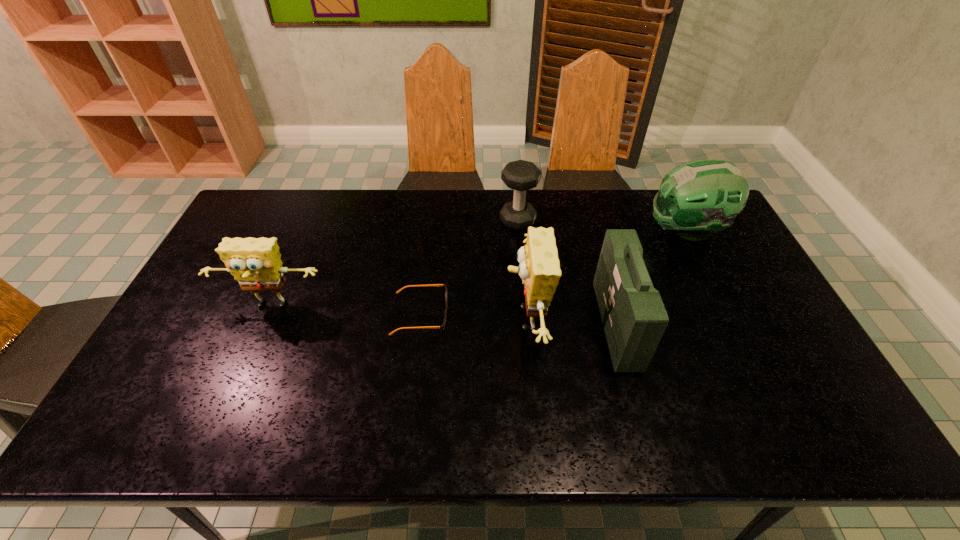
The image size is (960, 540). Find the location of `vacant space located 0.320m on the face of the taller sponge`. vacant space located 0.320m on the face of the taller sponge is located at coordinates (389, 320).

This screenshot has height=540, width=960. Find the location of `vacant space located on the face of the taller sponge`. vacant space located on the face of the taller sponge is located at coordinates (454, 320).

You are a GUI agent. You are given a task and a screenshot of the screen. Output one action in this format:
    pyautogui.click(x=<x>, y=<y>)
    Task: Click on the vacant point located on the right of the dumbbell
    
    Given the screenshot: What is the action you would take?
    pyautogui.click(x=554, y=221)

This screenshot has height=540, width=960. In order to click on free region located 0.310m on the visor of the rightmost object in this screenshot , I will do (555, 231).

Locate an element on the screen. The width and height of the screenshot is (960, 540). vacant area situated on the visor of the rightmost object is located at coordinates (552, 231).

Locate an element on the screen. The height and width of the screenshot is (540, 960). free space located on the visor of the rightmost object is located at coordinates (566, 231).

Identify the location of blank area located 0.280m on the front-facing side of the second object from right to left. This screenshot has height=540, width=960. (500, 325).

The height and width of the screenshot is (540, 960). Identify the location of vacant region located 0.340m on the front-facing side of the second object from right to left. (479, 325).

This screenshot has width=960, height=540. Find the location of `vacant position located on the front-facing side of the second object from right to left`. vacant position located on the front-facing side of the second object from right to left is located at coordinates (544, 325).

The width and height of the screenshot is (960, 540). In order to click on free spot located on the front-facing side of the shortest object in this screenshot , I will do `click(498, 314)`.